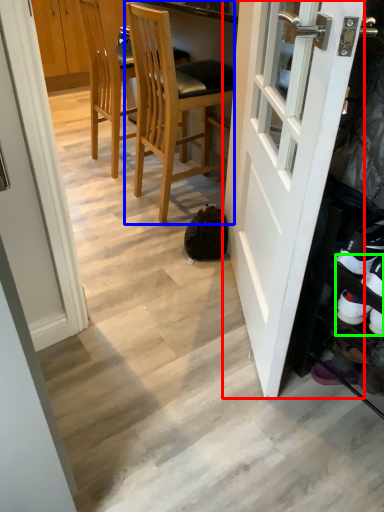
Question: Which object is the closest to the door (highlighted by a red box)? Choose among these: chair (highlighted by a blue box) or shoe (highlighted by a green box).

Choices:
 (A) chair
 (B) shoe

Answer: (B)